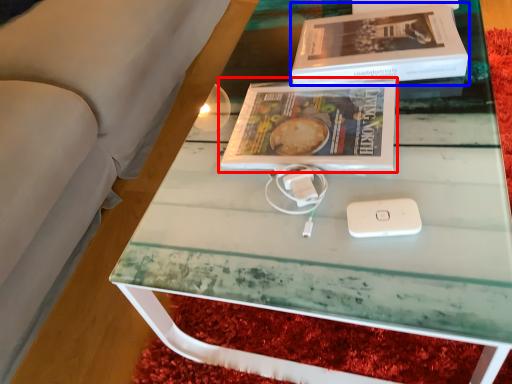
Question: Which object is further to the camera taking this photo, book (highlighted by a red box) or box (highlighted by a blue box)?

Choices:
 (A) book
 (B) box

Answer: (B)